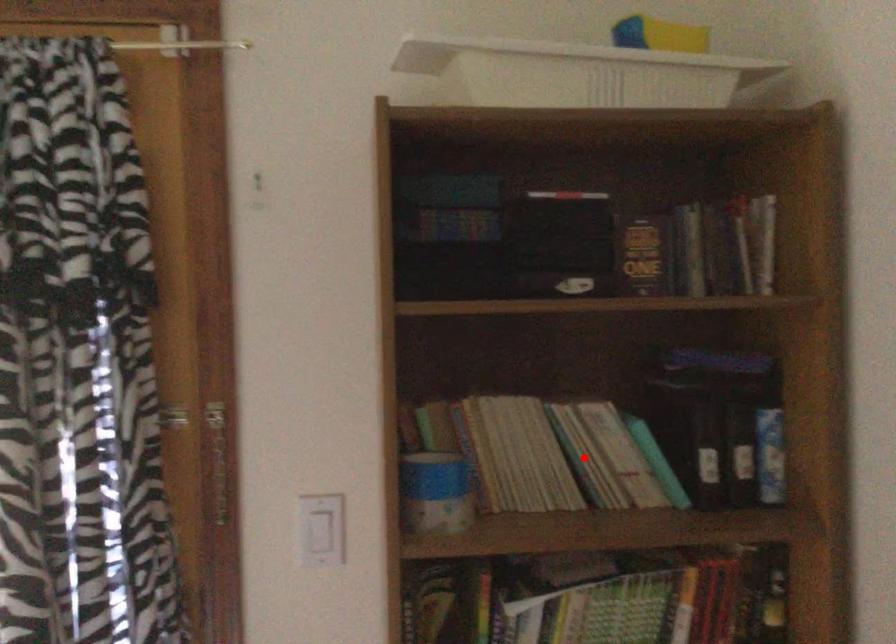
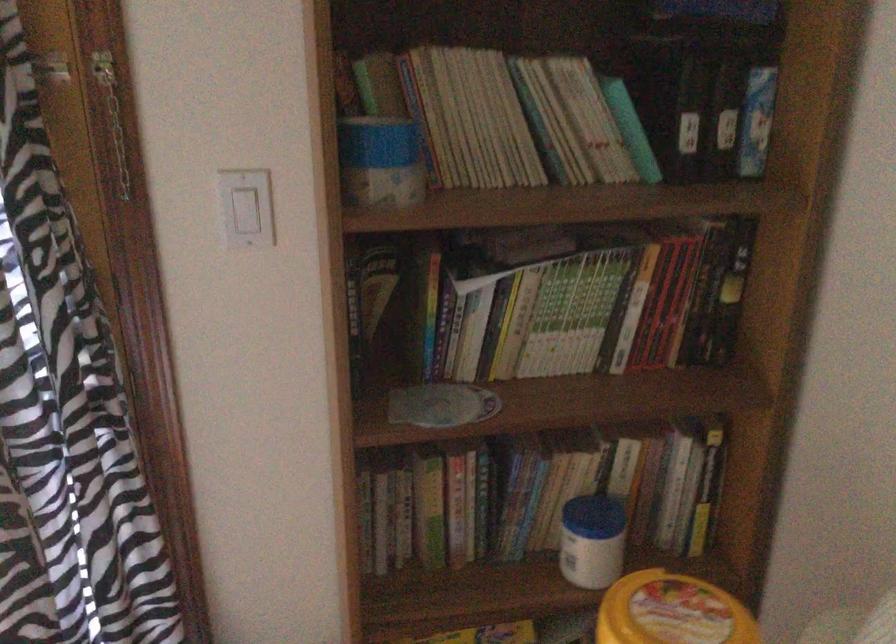
Where in the second image is the point corresponding to the highlighted location from the first image?

(549, 124)